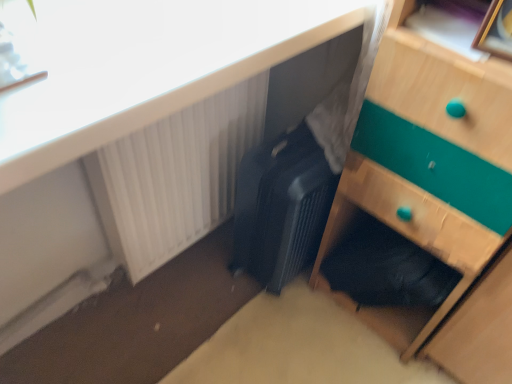
Question: Is white plastic radiator at upper left smaller than matte black suitcase at center?

Choices:
 (A) yes
 (B) no

Answer: (B)

Question: Is white plastic radiator at upper left oriented away from matte black suitcase at center?

Choices:
 (A) yes
 (B) no

Answer: (B)

Question: Considering the relative sizes of white plastic radiator at upper left and matte black suitcase at center in the image provided, is white plastic radiator at upper left thinner than matte black suitcase at center?

Choices:
 (A) yes
 (B) no

Answer: (A)

Question: Is white plastic radiator at upper left in contact with matte black suitcase at center?

Choices:
 (A) yes
 (B) no

Answer: (A)

Question: Is white plastic radiator at upper left not within matte black suitcase at center?

Choices:
 (A) yes
 (B) no

Answer: (A)

Question: From the image's perspective, relative to wooden chest of drawers at lower right, is matte black suitcase at center above or below?

Choices:
 (A) below
 (B) above

Answer: (B)

Question: Is matte black suitcase at center bigger or smaller than wooden chest of drawers at lower right?

Choices:
 (A) small
 (B) big

Answer: (A)

Question: Considering their positions, is matte black suitcase at center located in front of or behind wooden chest of drawers at lower right?

Choices:
 (A) behind
 (B) front

Answer: (B)

Question: Is matte black suitcase at center taller or shorter than wooden chest of drawers at lower right?

Choices:
 (A) tall
 (B) short

Answer: (B)

Question: From a real-world perspective, relative to matte black suitcase at center, is wooden picture frame at upper right vertically above or below?

Choices:
 (A) above
 (B) below

Answer: (A)

Question: Considering the relative positions of wooden picture frame at upper right and matte black suitcase at center in the image provided, is wooden picture frame at upper right to the left or to the right of matte black suitcase at center?

Choices:
 (A) left
 (B) right

Answer: (B)

Question: Is point (499, 46) positioned closer to the camera than point (143, 140)?

Choices:
 (A) closer
 (B) farther

Answer: (A)

Question: From the image's perspective, relative to matte black suitcase at center, is wooden picture frame at upper right above or below?

Choices:
 (A) below
 (B) above

Answer: (A)

Question: From a real-world perspective, is matte black suitcase at center above or below black textured suitcase at center?

Choices:
 (A) above
 (B) below

Answer: (A)

Question: Is matte black suitcase at center wider or thinner than black textured suitcase at center?

Choices:
 (A) thin
 (B) wide

Answer: (B)